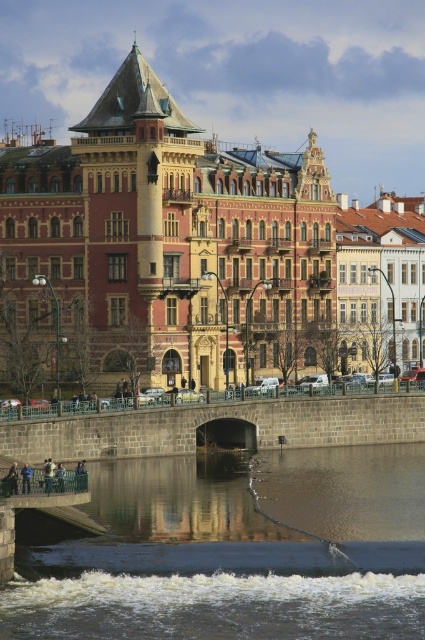
Which of these two, smooth concrete river at center or green metal bridge at lower left, stands shorter?

green metal bridge at lower left

Describe the element at coordinates (237, 552) in the screenshot. The width and height of the screenshot is (425, 640). I see `smooth concrete river at center` at that location.

You are a GUI agent. You are given a task and a screenshot of the screen. Output one action in this format:
    pyautogui.click(x=<x>, y=<y>)
    Task: Click on the smooth concrete river at center
    
    Given the screenshot: What is the action you would take?
    pyautogui.click(x=237, y=552)

Where is `smooth concrete river at center`? This screenshot has height=640, width=425. smooth concrete river at center is located at coordinates (237, 552).